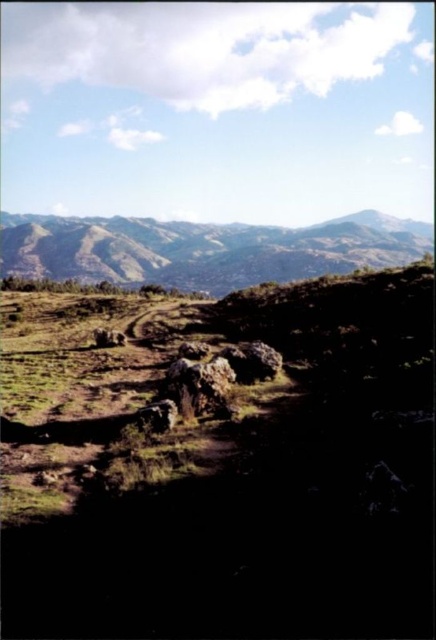
Is green grassy hillside at lower left shorter than rugged brown mountain at upper center?

Correct, green grassy hillside at lower left is not as tall as rugged brown mountain at upper center.

Between point (44, 464) and point (341, 220), which one is positioned in front?

Point (44, 464) is more forward.

The width and height of the screenshot is (436, 640). In order to click on green grassy hillside at lower left in this screenshot , I will do `click(220, 465)`.

Can you confirm if green grassy hillside at lower left is wider than rough textured rock at center?

Correct, the width of green grassy hillside at lower left exceeds that of rough textured rock at center.

Is point (235, 589) positioned after point (176, 380)?

That is False.

Locate an element on the screen. green grassy hillside at lower left is located at coordinates (220, 465).

Between rugged brown mountain at upper center and rough textured rock at center, which one is positioned lower?

rough textured rock at center is lower down.

What are the coordinates of `rugged brown mountain at upper center` in the screenshot? It's located at (203, 250).

Where is `rugged brown mountain at upper center`? rugged brown mountain at upper center is located at coordinates (203, 250).